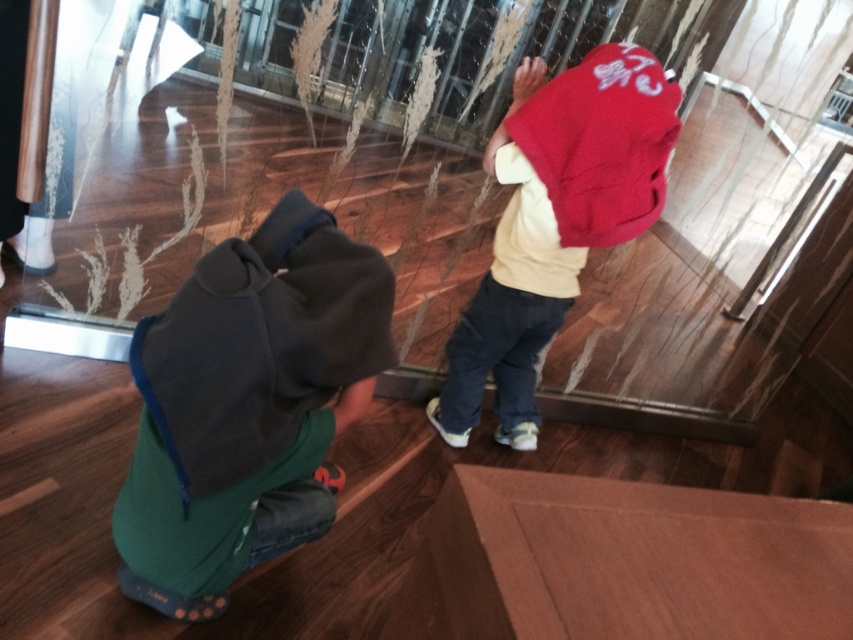
You are a delivery person trying to carry a large package through the transparent glass door at center. The package is as wide as the dark gray fleece jacket at lower left. Will the package fit through the door?

The transparent glass door at center is wider than the dark gray fleece jacket at lower left, so the package, which is as wide as the dark gray fleece jacket at lower left, will fit through the door.

You are a parent trying to ensure your children don not touch the glass door. You see the transparent glass door at center and the red fleece jacket at center. Which object is closer to the right side of the scene?

The transparent glass door at center is positioned on the right side of red fleece jacket at center, so it is closer to the right side of the scene.